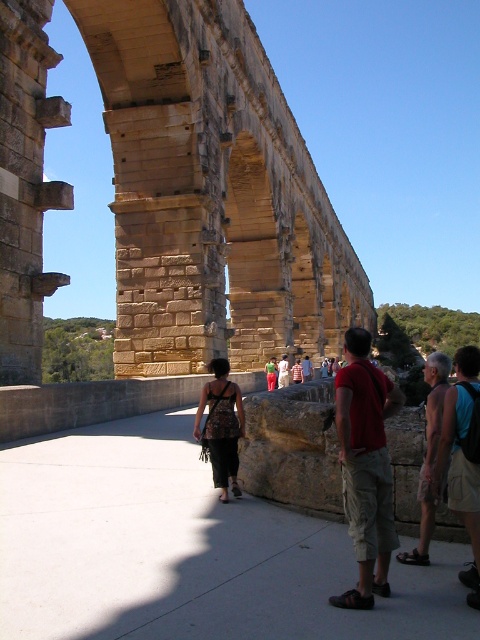
You are a photographer standing on the walkway at the Pont du Gard. You notice the red cotton shirt at center and the textured brown dress at center. Which clothing item is positioned higher relative to the other?

The red cotton shirt at center is above the textured brown dress at center, so it is positioned higher.

You are a photographer at the Pont du Gard and want to capture both the textured brown dress at center and the green fabric dress at center in your shot. Which dress should you adjust your camera to focus on first if you want to include both in the frame?

You should focus on the textured brown dress at center first because it is positioned to the left of the green fabric dress at center, ensuring both are included in the frame by starting from the left side.